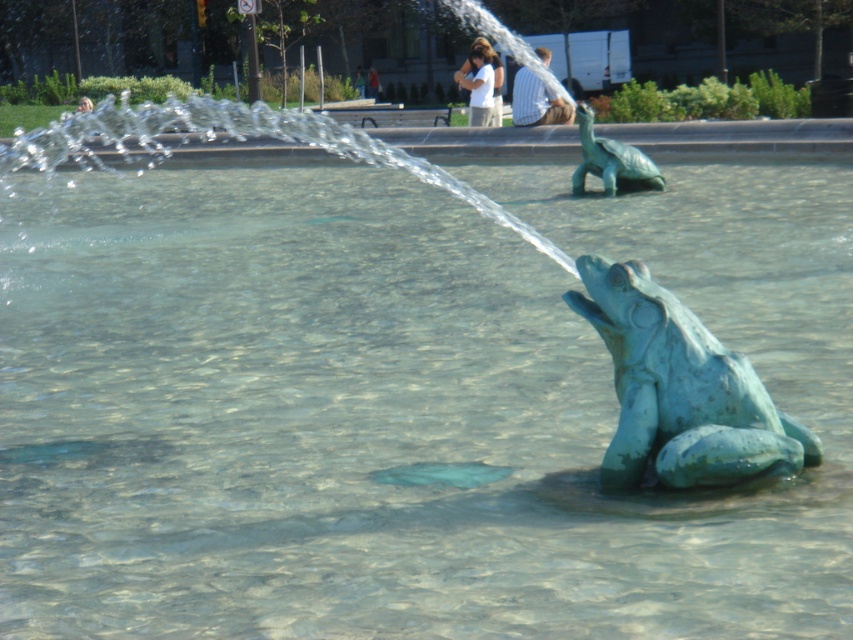
You are standing at a distance and want to take a photo of the green patina frog at center using a camera. The camera requires the subject to be within 20 feet for optimal focus. Can you capture a clear photo without moving closer?

The green patina frog at center and camera are 21.10 feet apart, which is beyond the camera requirement of 20 feet for optimal focus. Therefore, you cannot capture a clear photo without moving closer.

From the picture: You are standing in front of the fountain and want to take a photo of both the green patina frog at center and the green patina turtle at upper center. Which sculpture should you aim your camera towards first to ensure both are in frame?

You should aim your camera towards the green patina frog at center first because it is positioned to the left of the green patina turtle at upper center, so capturing the frog first will help frame both sculptures together.